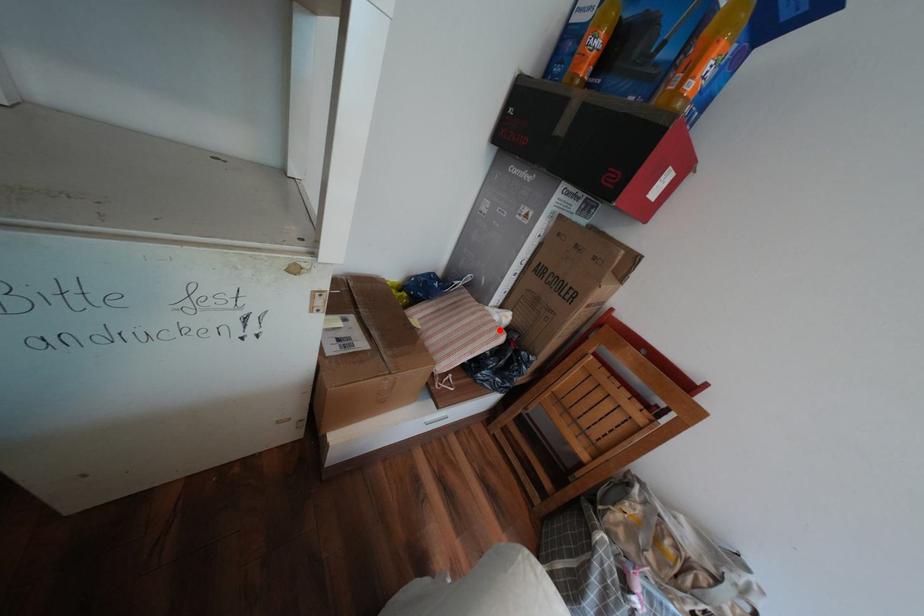
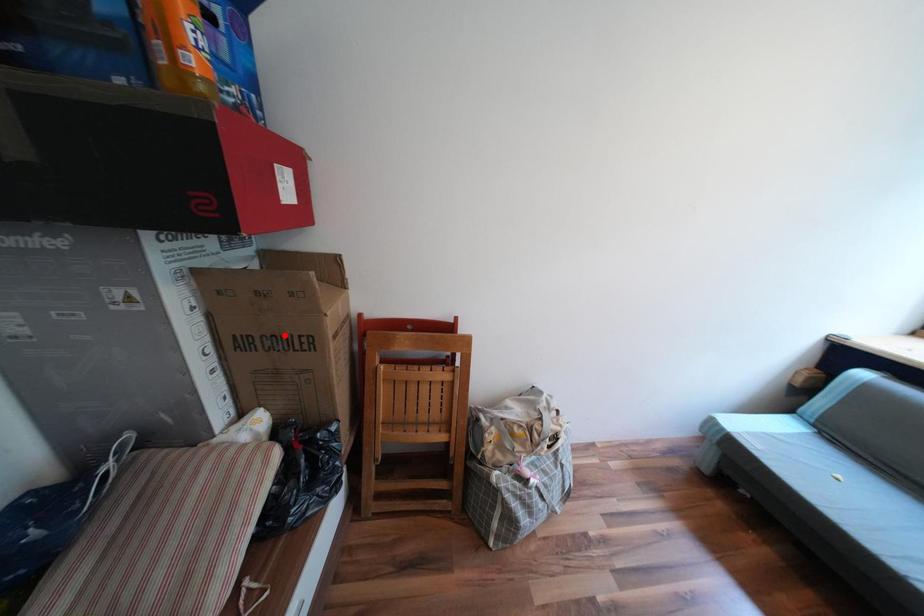
I am providing you with two images of the same scene from different viewpoints. A red point is marked on the first image and another point is marked on the second image. Is the marked point in image1 the same physical position as the marked point in image2?

No